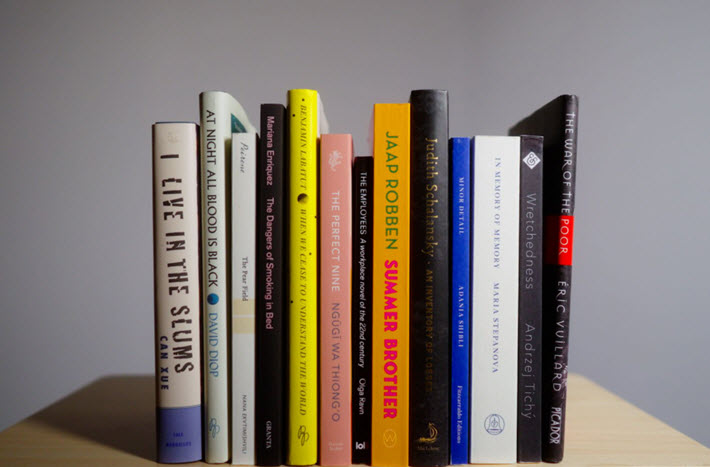
Identify the location of black books. (564, 198), (530, 206), (437, 201), (360, 206), (268, 198).